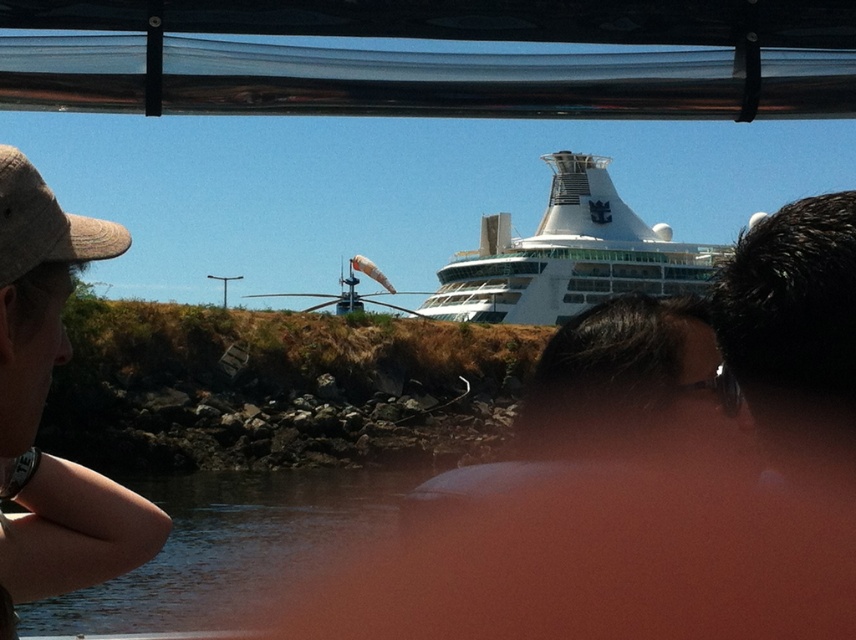
Question: Is clear water at lower center further to camera compared to white glossy cruise ship at center?

Choices:
 (A) no
 (B) yes

Answer: (A)

Question: Which point is closer to the camera taking this photo?

Choices:
 (A) (229, 556)
 (B) (497, 252)

Answer: (A)

Question: Which point is closer to the camera?

Choices:
 (A) (82, 531)
 (B) (710, 272)

Answer: (A)

Question: Which point is closer to the camera?

Choices:
 (A) brown fabric cap at left
 (B) clear water at lower center
 (C) white glossy cruise ship at center

Answer: (A)

Question: Can you confirm if brown fabric cap at left is positioned to the right of clear water at lower center?

Choices:
 (A) no
 (B) yes

Answer: (B)

Question: Can you confirm if brown fabric cap at left is positioned to the left of clear water at lower center?

Choices:
 (A) no
 (B) yes

Answer: (A)